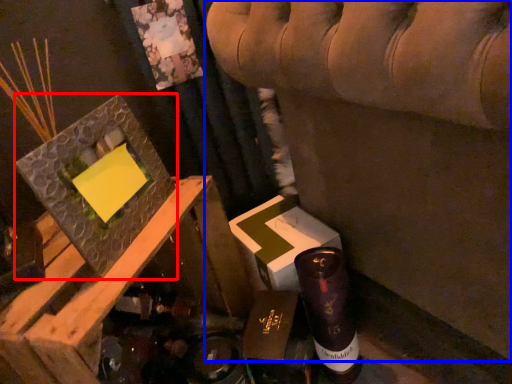
Question: Which point is further to the camera, picture frame (highlighted by a red box) or furniture (highlighted by a blue box)?

Choices:
 (A) picture frame
 (B) furniture

Answer: (A)